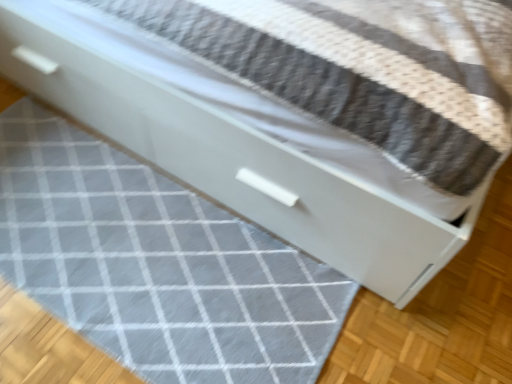
Identify the location of vacant location below gray textured bath mat at center (from a real-world perspective). (132, 248).